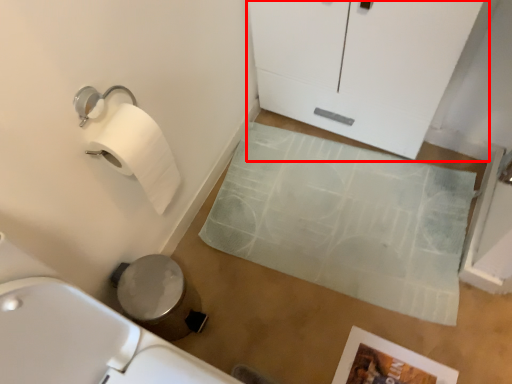
Question: From the image, what is the correct spatial relationship of glass door (annotated by the red box) in relation to bath mat?

Choices:
 (A) right
 (B) left

Answer: (A)